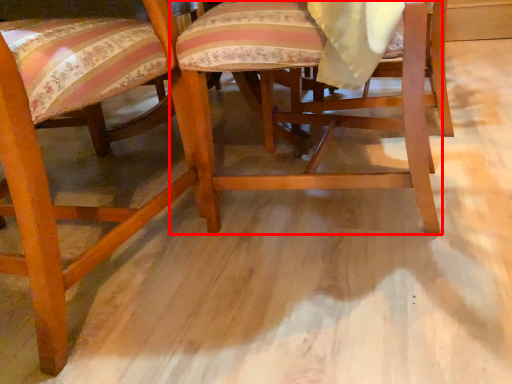
Question: Observing the image, what is the correct spatial positioning of chair (annotated by the red box) in reference to chair?

Choices:
 (A) left
 (B) right

Answer: (B)